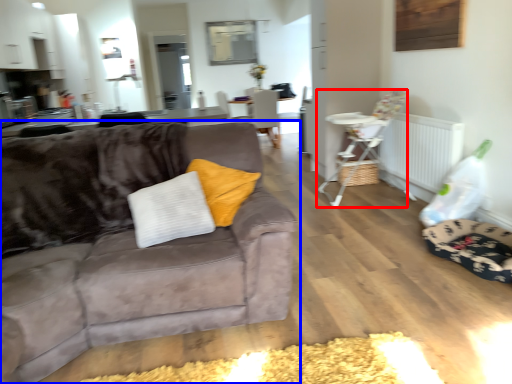
Question: Which object is further to the camera taking this photo, chair (highlighted by a red box) or studio couch (highlighted by a blue box)?

Choices:
 (A) chair
 (B) studio couch

Answer: (A)